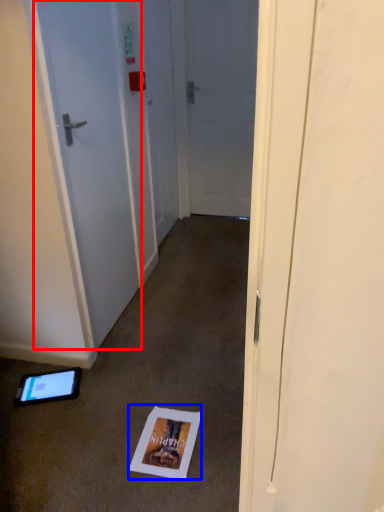
Question: Which object is closer to the camera taking this photo, door (highlighted by a red box) or postcard (highlighted by a blue box)?

Choices:
 (A) door
 (B) postcard

Answer: (A)